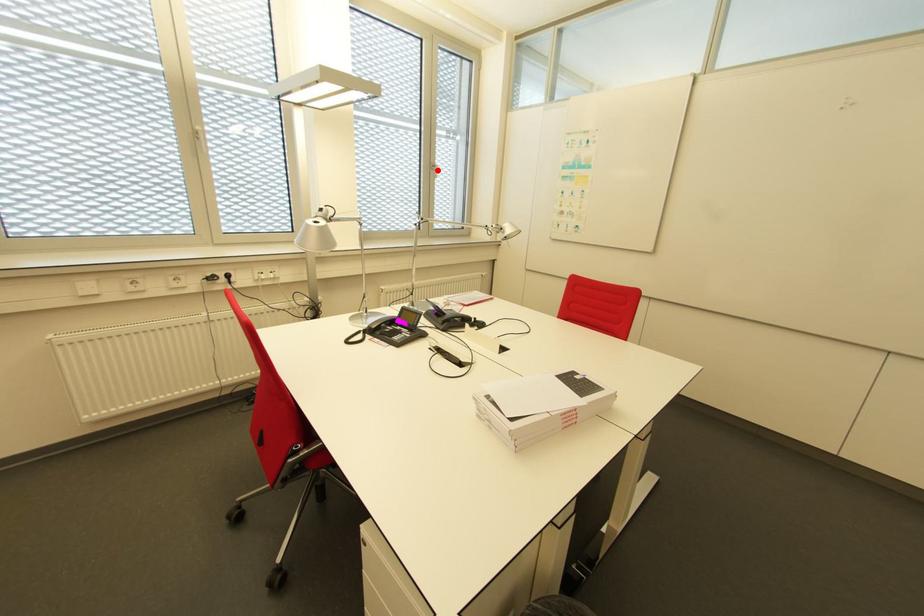
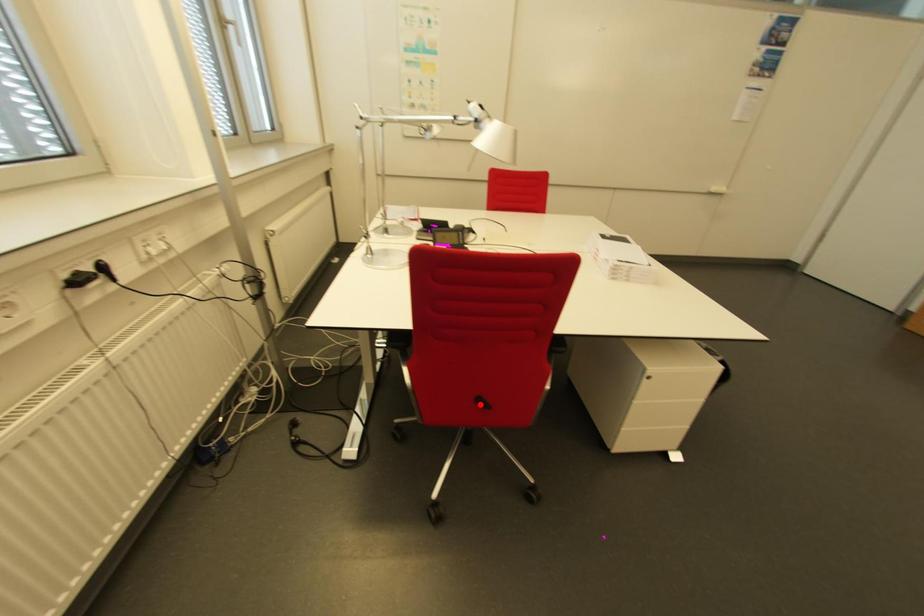
I am providing you with two images of the same scene from different viewpoints. A red point is marked on the first image and another point is marked on the second image. Does the point marked in image1 correspond to the same location as the one in image2?

No